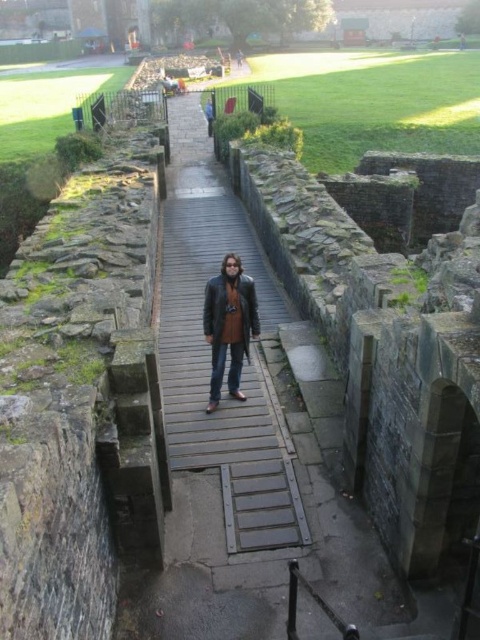
You are a tour guide explaining the historic site to visitors. You point out the wooden bridge at center and the brown leather jacket at center. Which object is located to the left of the other?

The wooden bridge at center is positioned on the left side of brown leather jacket at center, meaning the bridge is to the left of the jacket.

You are standing at the point marked as point [262,268] in the image. You want to throw a small ball to someone standing exactly where you are. What is the minimum distance you need to throw the ball?

The minimum distance you need to throw the ball is 21.21 meters because the point [262,268] and the viewer are 21.21 meters apart from each other.